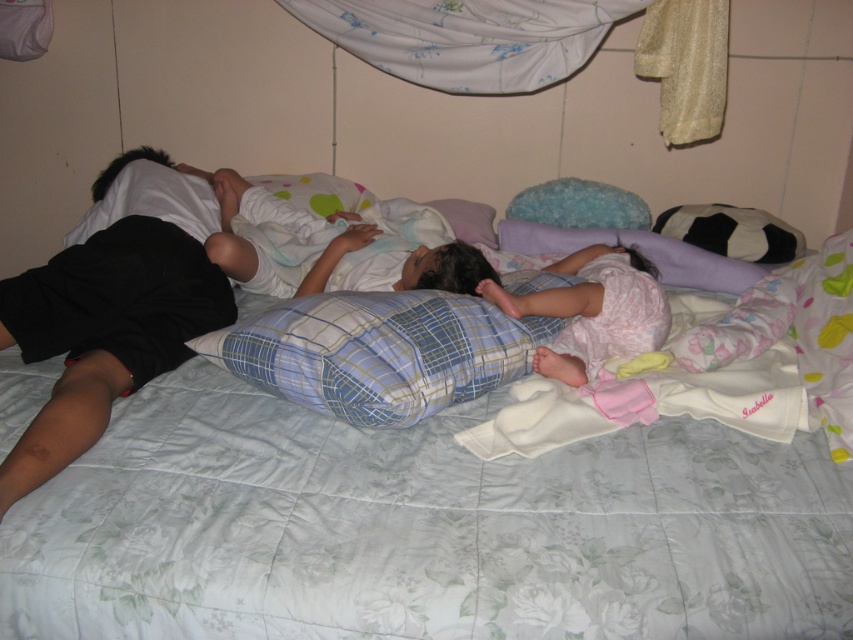
Question: Can you confirm if matte black pillow at left is positioned to the right of white soft pillow at center?

Choices:
 (A) yes
 (B) no

Answer: (B)

Question: Among these objects, which one is nearest to the camera?

Choices:
 (A) purple soft pillow at center
 (B) matte black pillow at left
 (C) pink cotton baby at center
 (D) white soft blanket at center

Answer: (B)

Question: Which point appears closest to the camera in this image?

Choices:
 (A) (361, 368)
 (B) (695, 324)

Answer: (A)

Question: Estimate the real-world distances between objects in this image. Which object is closer to the blue plaid pillow at center?

Choices:
 (A) white soft blanket at center
 (B) purple soft pillow at center
 (C) pink cotton baby at center
 (D) white floral bedspread at center

Answer: (D)

Question: Is white floral bedspread at center below pink cotton baby at center?

Choices:
 (A) no
 (B) yes

Answer: (B)

Question: Does blue plaid pillow at center have a smaller size compared to purple soft pillow at center?

Choices:
 (A) yes
 (B) no

Answer: (B)